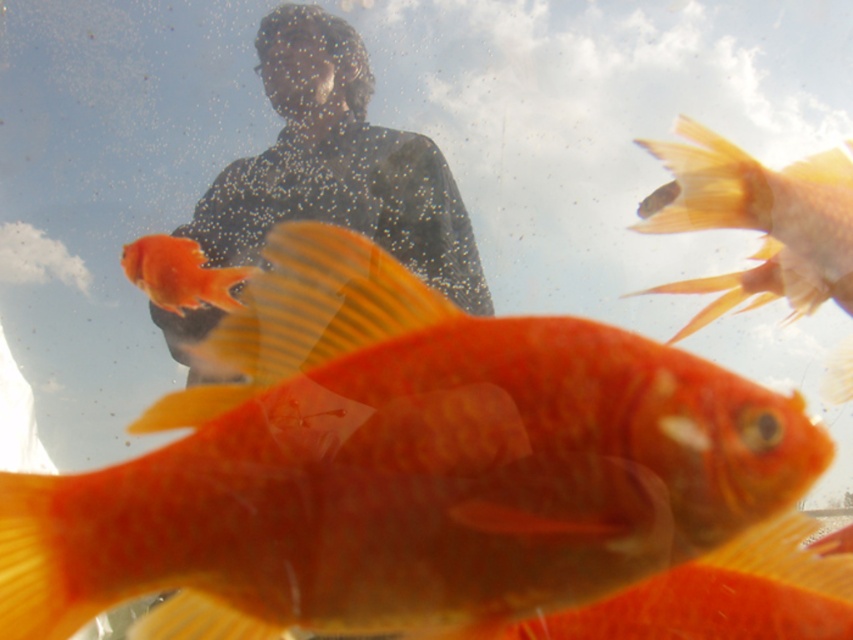
Question: Is matte black shirt at upper center smaller than orange matte goldfish at center?

Choices:
 (A) yes
 (B) no

Answer: (B)

Question: Is shiny orange fish at center above matte black shirt at upper center?

Choices:
 (A) yes
 (B) no

Answer: (B)

Question: Among these points, which one is farthest from the camera?

Choices:
 (A) (173, 264)
 (B) (424, 458)
 (C) (839, 372)
 (D) (279, 182)

Answer: (D)

Question: Does matte black shirt at upper center have a greater width compared to matte orange goldfish at center?

Choices:
 (A) yes
 (B) no

Answer: (A)

Question: Estimate the real-world distances between objects in this image. Which object is closer to the shiny orange fish at center?

Choices:
 (A) matte orange goldfish at center
 (B) orange matte goldfish at center

Answer: (B)

Question: Which of the following is the closest to the observer?

Choices:
 (A) (288, 150)
 (B) (593, 401)

Answer: (B)